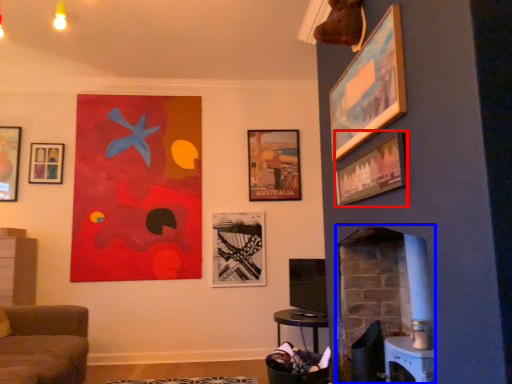
Question: Which object appears farthest to the camera in this image, picture frame (highlighted by a red box) or fireplace (highlighted by a blue box)?

Choices:
 (A) picture frame
 (B) fireplace

Answer: (B)